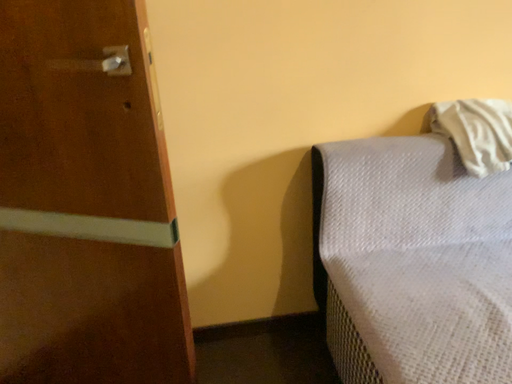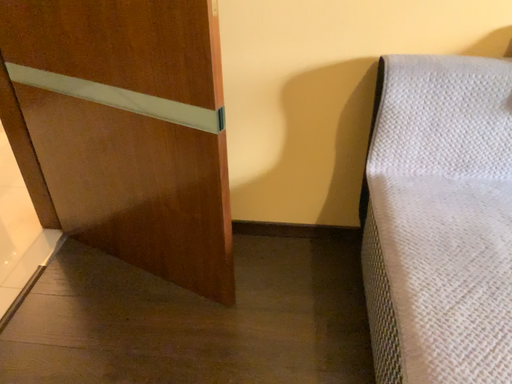
Question: Which way did the camera rotate in the video?

Choices:
 (A) rotated upward
 (B) rotated downward

Answer: (B)